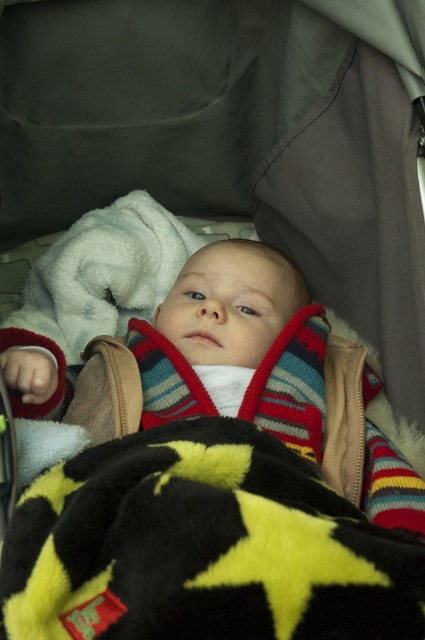
Question: Which point is farther from the camera taking this photo?

Choices:
 (A) (309, 344)
 (B) (153, 502)

Answer: (A)

Question: In this image, where is fluffy black blanket with yellow stars at center located relative to striped knit sweater at center?

Choices:
 (A) below
 (B) above

Answer: (A)

Question: Which point is farther to the camera?

Choices:
 (A) fluffy black blanket with yellow stars at center
 (B) striped knit sweater at center

Answer: (B)

Question: Is fluffy black blanket with yellow stars at center behind striped knit sweater at center?

Choices:
 (A) no
 (B) yes

Answer: (A)

Question: Does fluffy black blanket with yellow stars at center appear under striped knit sweater at center?

Choices:
 (A) no
 (B) yes

Answer: (B)